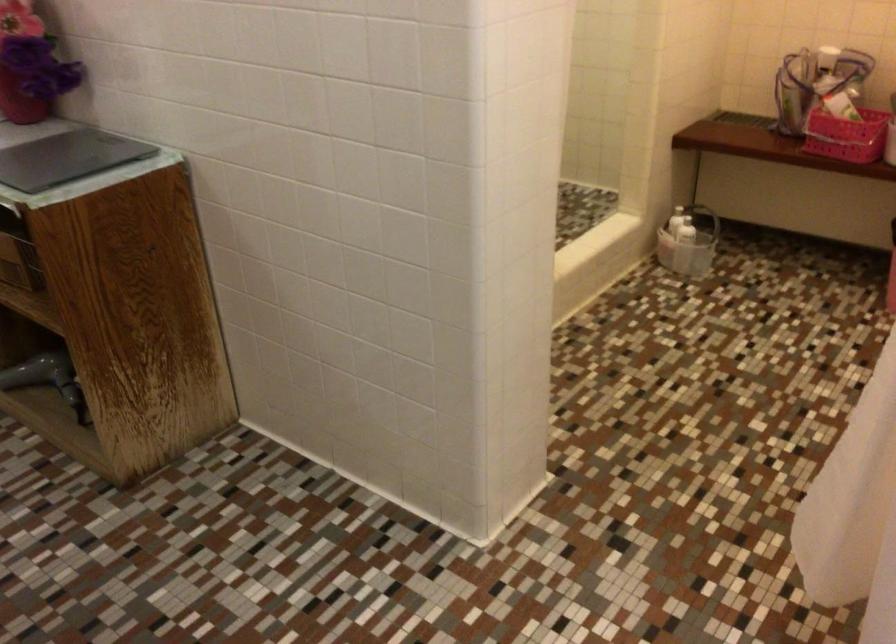
Where would you lift the pink plastic basket? Please return your answer as a coordinate pair (x, y).

(847, 136)